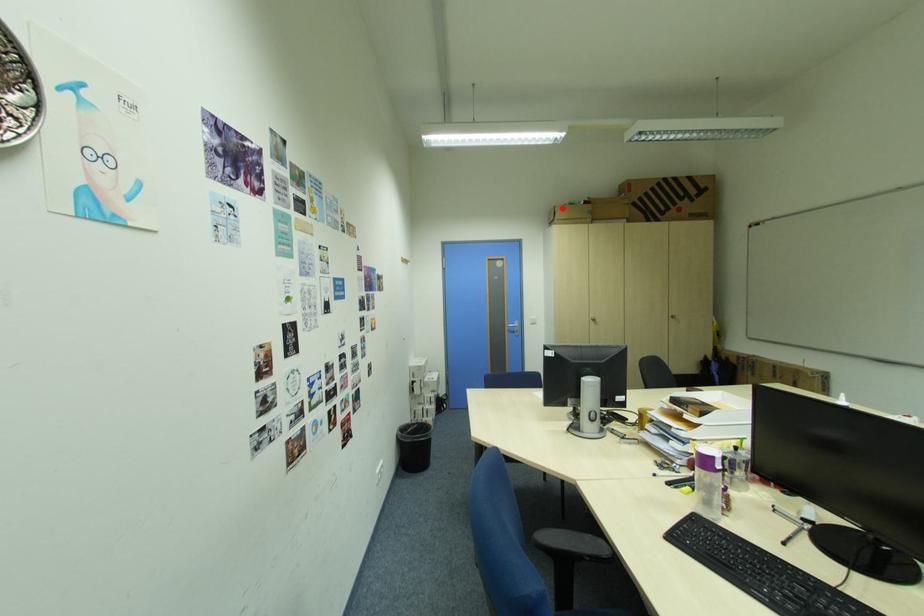
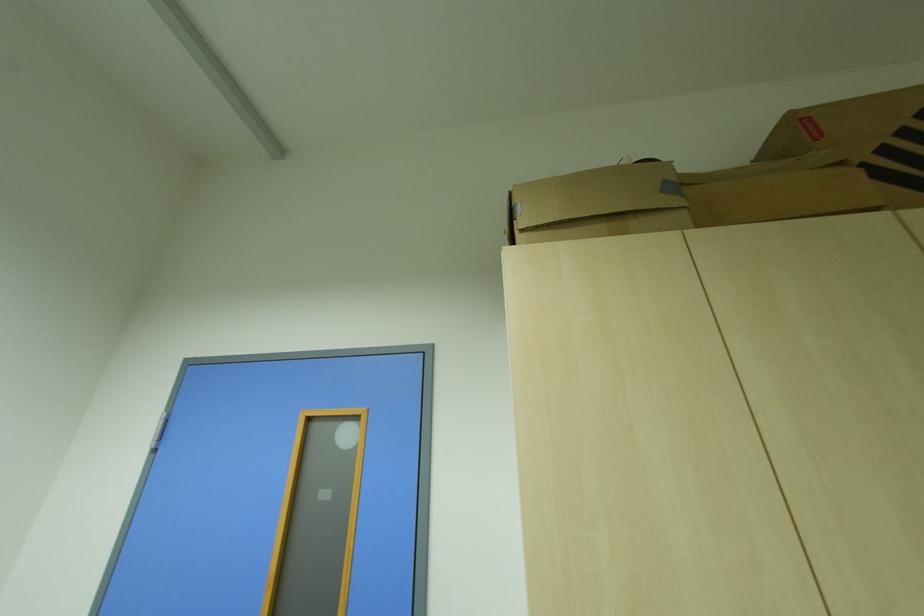
The point at the highlighted location is marked in the first image. Where is the corresponding point in the second image?

(517, 195)